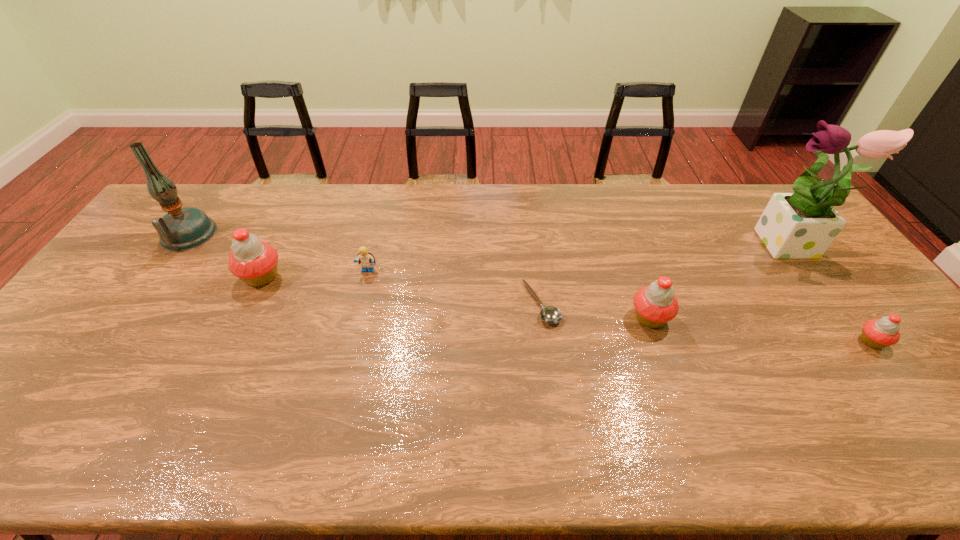
Locate an element on the screen. the farthest cupcake is located at coordinates (254, 261).

Identify the location of the leftmost cupcake. The image size is (960, 540). (254, 261).

Locate an element on the screen. This screenshot has width=960, height=540. the second cupcake from left to right is located at coordinates (656, 304).

I want to click on the second shortest cupcake, so click(x=656, y=304).

At what (x,y) coordinates should I click in order to perform the action: click on the rightmost cupcake. Please return your answer as a coordinate pair (x, y). This screenshot has height=540, width=960. Looking at the image, I should click on (877, 333).

Identify the location of the leftmost object. This screenshot has height=540, width=960. (180, 229).

At what (x,y) coordinates should I click in order to perform the action: click on oil lamp. Please return your answer as a coordinate pair (x, y). Looking at the image, I should click on (180, 229).

Where is `the tallest object`? The width and height of the screenshot is (960, 540). the tallest object is located at coordinates (802, 225).

I want to click on the fifth object from right to left, so click(366, 259).

Find the location of a particular element. ladle is located at coordinates (549, 314).